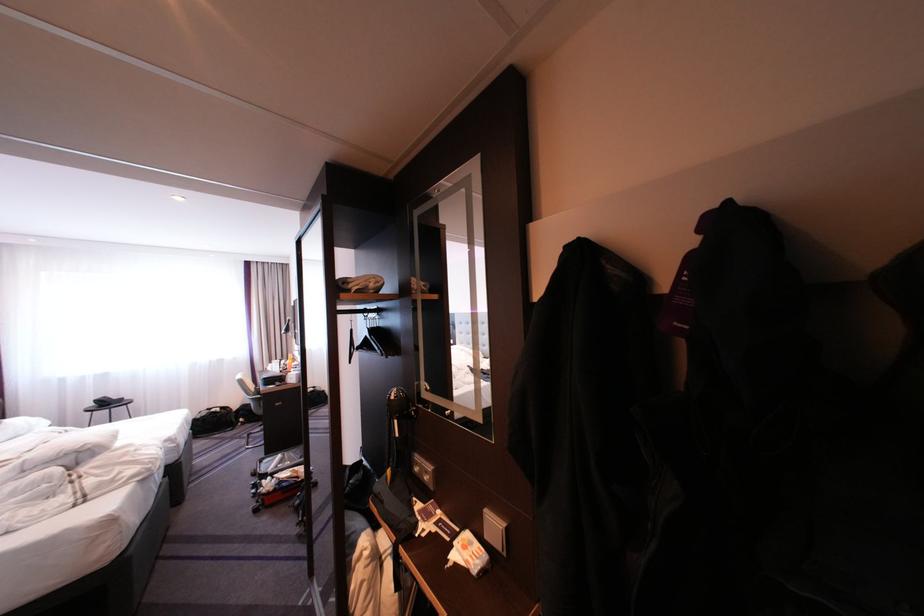
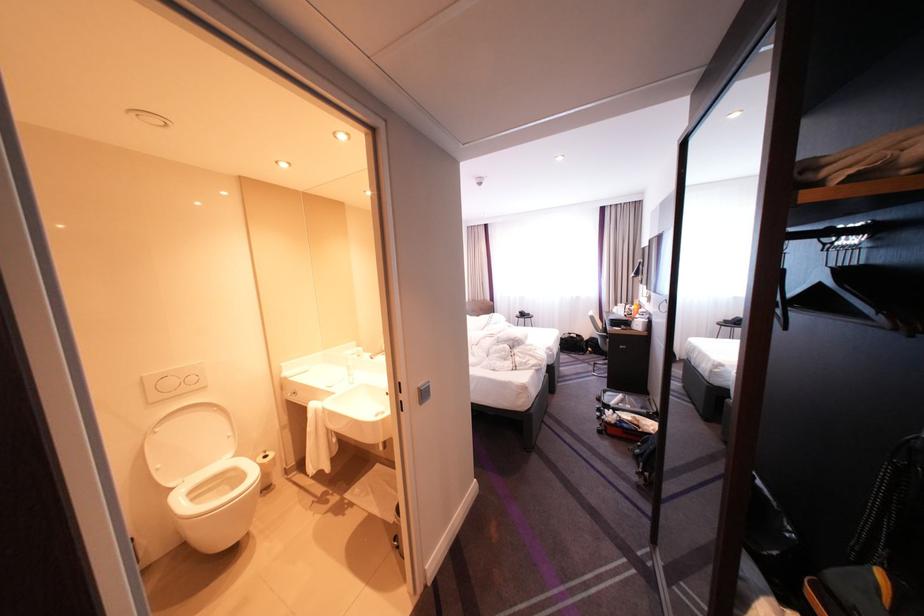
Locate, in the second image, the point that corresponds to (x=294, y=361) in the first image.

(638, 305)